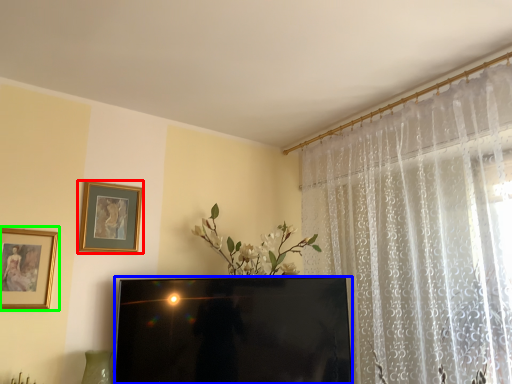
Question: Which object is the farthest from picture frame (highlighted by a red box)? Choose among these: television (highlighted by a blue box) or picture frame (highlighted by a green box).

Choices:
 (A) television
 (B) picture frame

Answer: (A)